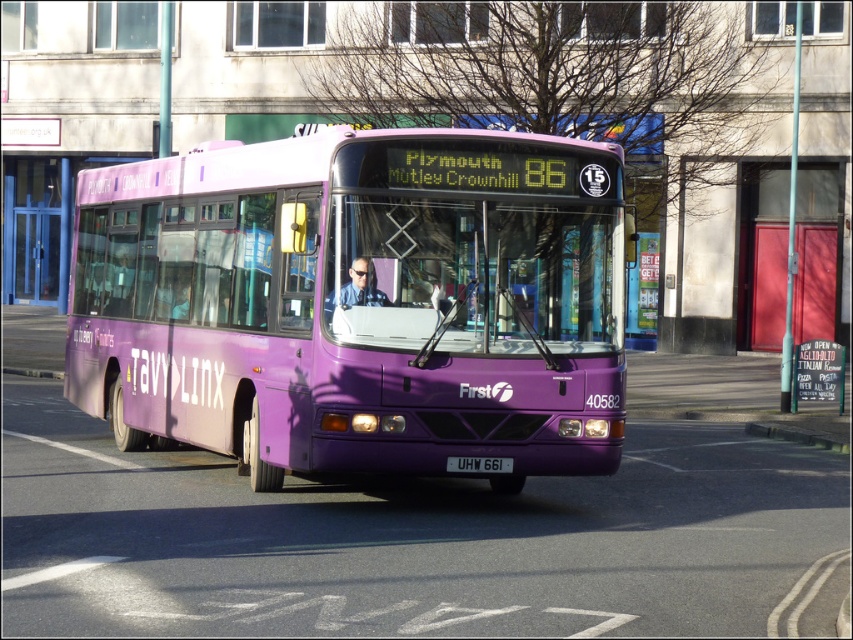
Which of these two, matte purple bus at center or black plastic license plate at center, stands shorter?

Standing shorter between the two is black plastic license plate at center.

Can you confirm if matte purple bus at center is positioned to the right of black plastic license plate at center?

Indeed, matte purple bus at center is positioned on the right side of black plastic license plate at center.

Does point (134, 344) lie in front of point (476, 465)?

No, (134, 344) is further to viewer.

You are a GUI agent. You are given a task and a screenshot of the screen. Output one action in this format:
    pyautogui.click(x=<x>, y=<y>)
    Task: Click on the matte purple bus at center
    The image size is (853, 640).
    Given the screenshot: What is the action you would take?
    pyautogui.click(x=357, y=301)

Between matte purple bus at center and purple rubber curb at lower center, which one appears on the right side from the viewer's perspective?

From the viewer's perspective, purple rubber curb at lower center appears more on the right side.

Is the position of matte purple bus at center less distant than that of purple rubber curb at lower center?

Yes.

At what (x,y) coordinates should I click in order to perform the action: click on matte purple bus at center. Please return your answer as a coordinate pair (x, y). This screenshot has height=640, width=853. Looking at the image, I should click on (357, 301).

Can you confirm if purple rubber curb at lower center is positioned below black plastic license plate at center?

Yes.

Who is lower down, purple rubber curb at lower center or black plastic license plate at center?

purple rubber curb at lower center

Which is behind, point (833, 448) or point (467, 467)?

Positioned behind is point (833, 448).

Locate an element on the screen. Image resolution: width=853 pixels, height=640 pixels. purple rubber curb at lower center is located at coordinates (793, 435).